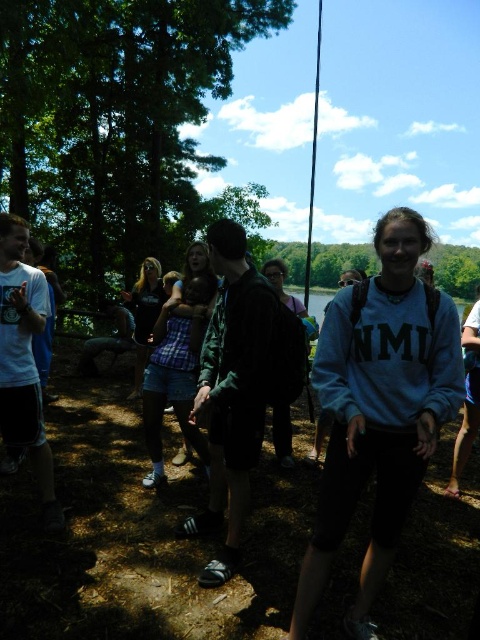
You are a photographer trying to capture a group photo of the gray fleece sweatshirt at center and the plaid fabric child at center. Since you want to ensure both subjects are in focus, you need to know their relative sizes. Which of the two is larger?

The gray fleece sweatshirt at center is bigger than the plaid fabric child at center, so you should adjust your camera settings to accommodate the larger subject.

Consider the image. You are a photographer trying to capture a clear shot of the black plastic fishing pole at center without any people blocking it. The gray fleece sweatshirt at center is currently in the way. What should you do to ensure the fishing pole is visible?

Move the camera position backward so that the gray fleece sweatshirt at center is no longer blocking the black plastic fishing pole at center. Alternatively, ask the person wearing the gray fleece sweatshirt at center to step aside temporarily to allow an unobstructed view of the black plastic fishing pole at center.

You are a photographer trying to capture a group photo of the people at the gathering. You notice the gray fleece sweatshirt at center and the black plastic fishing pole at center. Which object should you focus on to ensure it takes up more space in the photo?

The black plastic fishing pole at center should be focused on because it occupies more space than the gray fleece sweatshirt at center.